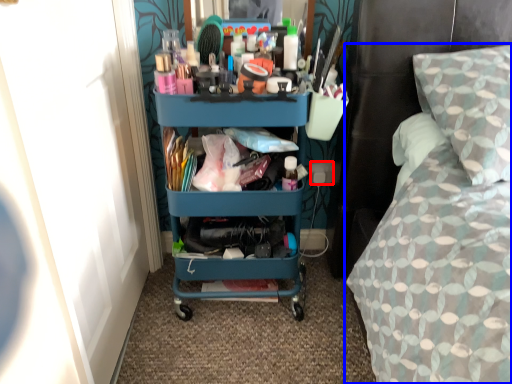
Question: Among these objects, which one is nearest to the camera, power outlet (highlighted by a red box) or bed (highlighted by a blue box)?

Choices:
 (A) power outlet
 (B) bed

Answer: (B)